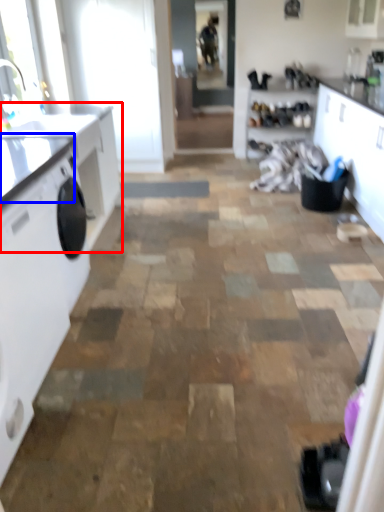
Question: Among these objects, which one is nearest to the camera, countertop (highlighted by a red box) or counter top (highlighted by a blue box)?

Choices:
 (A) countertop
 (B) counter top

Answer: (B)